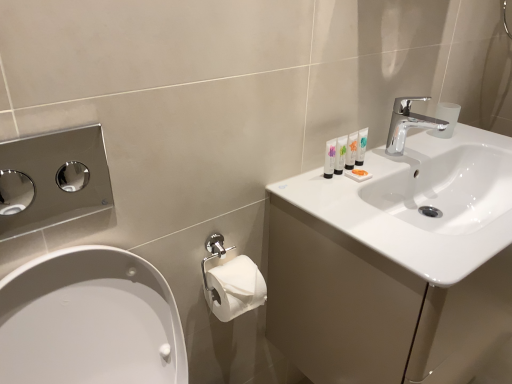
Where is `white glossy sink at upper right`? The image size is (512, 384). white glossy sink at upper right is located at coordinates (420, 198).

Where is `white glossy tubes at upper right, the first mouthwash when ordered from left to right`? This screenshot has height=384, width=512. white glossy tubes at upper right, the first mouthwash when ordered from left to right is located at coordinates (330, 158).

Measure the distance between point (353, 162) and camera.

Point (353, 162) and camera are 3.61 feet apart from each other.

In order to face translucent plastic tubes at upper right, placed as the 4th mouthwash when sorted from left to right, should I rotate leftwards or rightwards?

Rotate right and turn 14.258 degrees.

The width and height of the screenshot is (512, 384). I want to click on translucent plastic tubes at upper right, the third mouthwash from the right, so click(340, 155).

Describe the element at coordinates (340, 155) in the screenshot. I see `translucent plastic tubes at upper right, the third mouthwash from the right` at that location.

Describe the element at coordinates (52, 180) in the screenshot. I see `polished chrome hand dryer at left` at that location.

The image size is (512, 384). Describe the element at coordinates (376, 308) in the screenshot. I see `white glossy sink at upper right` at that location.

The width and height of the screenshot is (512, 384). Find the location of `white glossy sink at upper right`. white glossy sink at upper right is located at coordinates (420, 198).

Considering the sizes of translucent plastic tubes at upper right, arranged as the 1th mouthwash when viewed from the right, and white glossy tube at upper right, which is the 3th mouthwash in left-to-right order, in the image, is translucent plastic tubes at upper right, arranged as the 1th mouthwash when viewed from the right, wider or thinner than white glossy tube at upper right, which is the 3th mouthwash in left-to-right order,?

Clearly, translucent plastic tubes at upper right, arranged as the 1th mouthwash when viewed from the right, has less width compared to white glossy tube at upper right, which is the 3th mouthwash in left-to-right order.

Is translucent plastic tubes at upper right, arranged as the 1th mouthwash when viewed from the right, oriented away from white glossy tube at upper right, arranged as the second mouthwash when viewed from the right?

translucent plastic tubes at upper right, arranged as the 1th mouthwash when viewed from the right, is not turned away from white glossy tube at upper right, arranged as the second mouthwash when viewed from the right.

Measure the distance between translucent plastic tubes at upper right, placed as the 4th mouthwash when sorted from left to right, and white glossy tube at upper right, arranged as the second mouthwash when viewed from the right.

translucent plastic tubes at upper right, placed as the 4th mouthwash when sorted from left to right, and white glossy tube at upper right, arranged as the second mouthwash when viewed from the right, are 1.17 inches apart.

Is translucent plastic tubes at upper right, arranged as the 1th mouthwash when viewed from the right, further to camera compared to white glossy tube at upper right, which is the 3th mouthwash in left-to-right order?

That is True.

Based on their sizes in the image, would you say translucent plastic tubes at upper right, arranged as the 1th mouthwash when viewed from the right, is bigger or smaller than chrome metallic faucet at upper right?

In the image, translucent plastic tubes at upper right, arranged as the 1th mouthwash when viewed from the right, appears to be smaller than chrome metallic faucet at upper right.

Considering the relative positions of translucent plastic tubes at upper right, placed as the 4th mouthwash when sorted from left to right, and chrome metallic faucet at upper right in the image provided, is translucent plastic tubes at upper right, placed as the 4th mouthwash when sorted from left to right, to the left or to the right of chrome metallic faucet at upper right?

In the image, translucent plastic tubes at upper right, placed as the 4th mouthwash when sorted from left to right, appears on the left side of chrome metallic faucet at upper right.

Is translucent plastic tubes at upper right, arranged as the 1th mouthwash when viewed from the right, in front of or behind chrome metallic faucet at upper right in the image?

In the image, translucent plastic tubes at upper right, arranged as the 1th mouthwash when viewed from the right, appears behind chrome metallic faucet at upper right.

Considering the sizes of objects translucent plastic tubes at upper right, arranged as the 1th mouthwash when viewed from the right, and chrome metallic faucet at upper right in the image provided, who is shorter, translucent plastic tubes at upper right, arranged as the 1th mouthwash when viewed from the right, or chrome metallic faucet at upper right?

translucent plastic tubes at upper right, arranged as the 1th mouthwash when viewed from the right.

Locate an element on the screen. The height and width of the screenshot is (384, 512). tap above the white glossy tube at upper right, arranged as the second mouthwash when viewed from the right (from the image's perspective) is located at coordinates (408, 124).

Based on their sizes in the image, would you say white glossy tube at upper right, arranged as the second mouthwash when viewed from the right, is bigger or smaller than chrome metallic faucet at upper right?

Clearly, white glossy tube at upper right, arranged as the second mouthwash when viewed from the right, is smaller in size than chrome metallic faucet at upper right.

Does white glossy tube at upper right, arranged as the second mouthwash when viewed from the right, turn towards chrome metallic faucet at upper right?

No, white glossy tube at upper right, arranged as the second mouthwash when viewed from the right, is not oriented towards chrome metallic faucet at upper right.

Can you confirm if white glossy tube at upper right, arranged as the second mouthwash when viewed from the right, is thinner than chrome metallic faucet at upper right?

Correct, the width of white glossy tube at upper right, arranged as the second mouthwash when viewed from the right, is less than that of chrome metallic faucet at upper right.

Is the surface of white glossy tubes at upper right, the first mouthwash when ordered from left to right, in direct contact with chrome metallic faucet at upper right?

white glossy tubes at upper right, the first mouthwash when ordered from left to right, and chrome metallic faucet at upper right are not in contact.

Would you say chrome metallic faucet at upper right is part of white glossy tubes at upper right, which ranks as the 4th mouthwash in right-to-left order,'s contents?

Actually, chrome metallic faucet at upper right is outside white glossy tubes at upper right, which ranks as the 4th mouthwash in right-to-left order.

From their relative heights in the image, would you say white glossy tubes at upper right, which ranks as the 4th mouthwash in right-to-left order, is taller or shorter than chrome metallic faucet at upper right?

Clearly, white glossy tubes at upper right, which ranks as the 4th mouthwash in right-to-left order, is shorter compared to chrome metallic faucet at upper right.

Is translucent plastic tubes at upper right, placed as the 4th mouthwash when sorted from left to right, behind polished chrome hand dryer at left?

Yes, the depth of translucent plastic tubes at upper right, placed as the 4th mouthwash when sorted from left to right, is greater than that of polished chrome hand dryer at left.

At what (x,y) coordinates should I click in order to perform the action: click on the 4th mouthwash behind the polished chrome hand dryer at left, starting your count from the anchor. Please return your answer as a coordinate pair (x, y). The width and height of the screenshot is (512, 384). Looking at the image, I should click on (361, 146).

Would you say polished chrome hand dryer at left is part of translucent plastic tubes at upper right, arranged as the 1th mouthwash when viewed from the right,'s contents?

No, translucent plastic tubes at upper right, arranged as the 1th mouthwash when viewed from the right, does not contain polished chrome hand dryer at left.

Which of these two, translucent plastic tubes at upper right, placed as the 4th mouthwash when sorted from left to right, or polished chrome hand dryer at left, stands taller?

Standing taller between the two is polished chrome hand dryer at left.

Who is taller, translucent plastic tubes at upper right, the second mouthwash from the left, or chrome metallic faucet at upper right?

Standing taller between the two is chrome metallic faucet at upper right.

Is translucent plastic tubes at upper right, the third mouthwash from the right, in front of or behind chrome metallic faucet at upper right in the image?

In the image, translucent plastic tubes at upper right, the third mouthwash from the right, appears in front of chrome metallic faucet at upper right.

Is translucent plastic tubes at upper right, the second mouthwash from the left, outside of chrome metallic faucet at upper right?

translucent plastic tubes at upper right, the second mouthwash from the left, lies outside chrome metallic faucet at upper right's area.

This screenshot has width=512, height=384. Find the location of `the 3rd mouthwash positioned below the chrome metallic faucet at upper right (from a real-world perspective)`. the 3rd mouthwash positioned below the chrome metallic faucet at upper right (from a real-world perspective) is located at coordinates (340, 155).

Is white glossy sink at upper right bigger or smaller than polished chrome hand dryer at left?

In the image, white glossy sink at upper right appears to be larger than polished chrome hand dryer at left.

Is there a large distance between white glossy sink at upper right and polished chrome hand dryer at left?

white glossy sink at upper right is positioned a significant distance from polished chrome hand dryer at left.

Is white glossy sink at upper right further to camera compared to polished chrome hand dryer at left?

Yes, white glossy sink at upper right is further from the camera.

Which point is more forward, (370, 210) or (32, 212)?

Positioned in front is point (370, 210).

Image resolution: width=512 pixels, height=384 pixels. What are the coordinates of `mouthwash that is on the right side of white glossy tube at upper right, arranged as the second mouthwash when viewed from the right` in the screenshot? It's located at (361, 146).

This screenshot has height=384, width=512. What are the coordinates of `the 2nd mouthwash behind the chrome metallic faucet at upper right, counting from the anchor's position` in the screenshot? It's located at (361, 146).

From the image, which object appears to be farther from white glossy sink at upper right, chrome metallic faucet at upper right or polished chrome hand dryer at left?

polished chrome hand dryer at left lies further to white glossy sink at upper right than the other object.

When comparing their distances from white glossy tube at upper right, arranged as the second mouthwash when viewed from the right, does white glossy sink at upper right or white glossy tubes at upper right, which ranks as the 4th mouthwash in right-to-left order, seem further?

white glossy sink at upper right lies further to white glossy tube at upper right, arranged as the second mouthwash when viewed from the right, than the other object.

Looking at the image, which one is located further to white glossy tubes at upper right, which ranks as the 4th mouthwash in right-to-left order, white glossy sink at upper right or white glossy sink at upper right?

white glossy sink at upper right is positioned further to the anchor white glossy tubes at upper right, which ranks as the 4th mouthwash in right-to-left order.

Considering their positions, is white glossy tubes at upper right, which ranks as the 4th mouthwash in right-to-left order, positioned further to white glossy sink at upper right than white glossy tube at upper right, arranged as the second mouthwash when viewed from the right?

white glossy tubes at upper right, which ranks as the 4th mouthwash in right-to-left order, is positioned further to the anchor white glossy sink at upper right.

When comparing their distances from polished chrome hand dryer at left, does translucent plastic tubes at upper right, placed as the 4th mouthwash when sorted from left to right, or white glossy sink at upper right seem closer?

white glossy sink at upper right is closer to polished chrome hand dryer at left.

Based on the photo, estimate the real-world distances between objects in this image. Which object is further from white glossy sink at upper right, translucent plastic tubes at upper right, the second mouthwash from the left, or white glossy tube at upper right, which is the 3th mouthwash in left-to-right order?

white glossy tube at upper right, which is the 3th mouthwash in left-to-right order.

From the picture: Based on their spatial positions, is white glossy sink at upper right or white glossy tubes at upper right, which ranks as the 4th mouthwash in right-to-left order, further from white glossy sink at upper right?

Based on the image, white glossy tubes at upper right, which ranks as the 4th mouthwash in right-to-left order, appears to be further to white glossy sink at upper right.

Based on their spatial positions, is polished chrome hand dryer at left or chrome metallic faucet at upper right closer to white glossy sink at upper right?

Based on the image, chrome metallic faucet at upper right appears to be nearer to white glossy sink at upper right.

Locate an element on the screen. bathroom cabinet between white glossy sink at upper right and translucent plastic tubes at upper right, placed as the 4th mouthwash when sorted from left to right, along the z-axis is located at coordinates (376, 308).

Identify the location of bathroom cabinet positioned between white glossy sink at upper right and translucent plastic tubes at upper right, the second mouthwash from the left, from near to far. The image size is (512, 384). (376, 308).

Image resolution: width=512 pixels, height=384 pixels. I want to click on tap situated between polished chrome hand dryer at left and white glossy sink at upper right from left to right, so click(x=408, y=124).

Where is `mouthwash between translucent plastic tubes at upper right, the second mouthwash from the left, and translucent plastic tubes at upper right, placed as the 4th mouthwash when sorted from left to right`? This screenshot has width=512, height=384. mouthwash between translucent plastic tubes at upper right, the second mouthwash from the left, and translucent plastic tubes at upper right, placed as the 4th mouthwash when sorted from left to right is located at coordinates (351, 150).